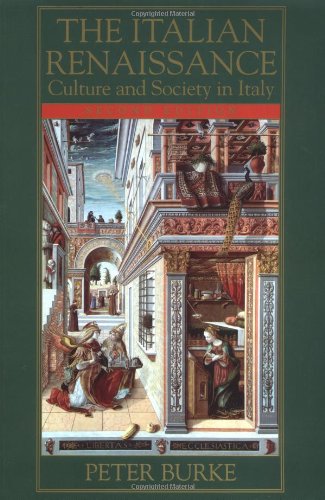
Find the location of a particular element. The height and width of the screenshot is (500, 325). archway is located at coordinates (102, 238).